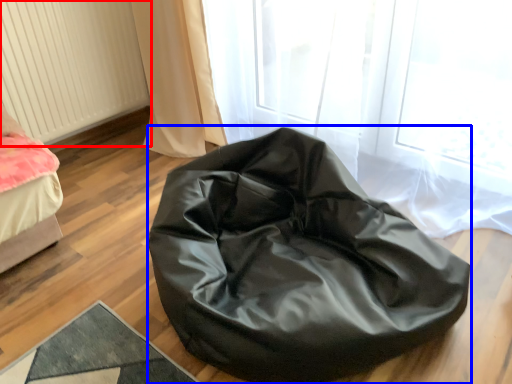
Question: Among these objects, which one is farthest to the camera, radiator (highlighted by a red box) or furniture (highlighted by a blue box)?

Choices:
 (A) radiator
 (B) furniture

Answer: (A)